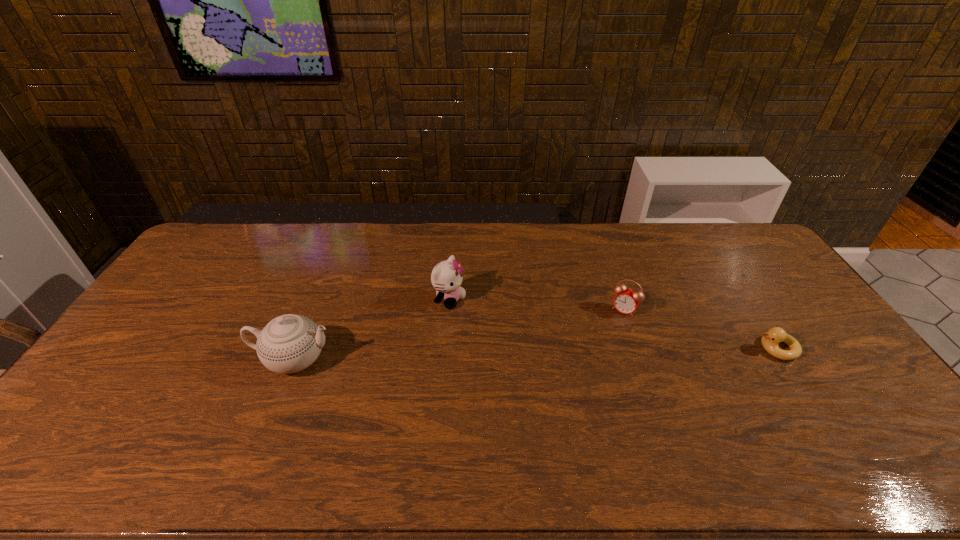
Find the location of a particular element. The width and height of the screenshot is (960, 540). vacant region between the third object from right to left and the shortest object is located at coordinates (613, 323).

Where is `the third closest object to the third object from right to left`? The width and height of the screenshot is (960, 540). the third closest object to the third object from right to left is located at coordinates (770, 340).

The height and width of the screenshot is (540, 960). In order to click on the second closest object to the kitten in this screenshot , I will do `click(626, 301)`.

In order to click on vacant area that satisfies the following two spatial constraints: 1. on the front side of the duckling; 2. at the beak of the alarm clock in this screenshot , I will do `click(637, 348)`.

The width and height of the screenshot is (960, 540). What are the coordinates of `free space in the image that satisfies the following two spatial constraints: 1. on the front side of the kitten; 2. at the beak of the shortest object` in the screenshot? It's located at (445, 348).

I want to click on vacant region that satisfies the following two spatial constraints: 1. on the front side of the rightmost object; 2. at the beak of the kitten, so click(445, 348).

Image resolution: width=960 pixels, height=540 pixels. In order to click on vacant space that satisfies the following two spatial constraints: 1. on the front side of the rightmost object; 2. at the beak of the kitten in this screenshot , I will do `click(445, 348)`.